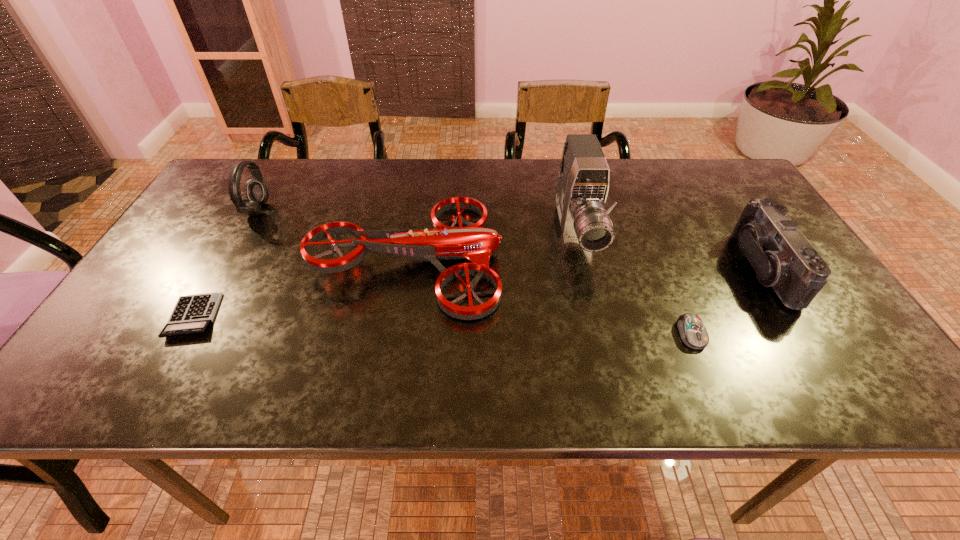
At what (x,y) coordinates should I click in order to perform the action: click on headset that is positioned at the left edge. Please return your answer as a coordinate pair (x, y). The image size is (960, 540). Looking at the image, I should click on click(257, 191).

Locate an element on the screen. calculator that is at the left edge is located at coordinates (193, 314).

Where is `object that is at the right edge`? object that is at the right edge is located at coordinates (782, 257).

Image resolution: width=960 pixels, height=540 pixels. I want to click on object that is positioned at the far left corner, so click(257, 191).

The height and width of the screenshot is (540, 960). In order to click on free location at the far edge of the desktop in this screenshot , I will do `click(399, 204)`.

In the image, there is a desktop. Where is `vacant space at the left edge`? The image size is (960, 540). vacant space at the left edge is located at coordinates (197, 281).

Locate an element on the screen. The image size is (960, 540). vacant space at the right edge of the desktop is located at coordinates (722, 222).

The height and width of the screenshot is (540, 960). What are the coordinates of `free space at the near right corner` in the screenshot? It's located at (839, 383).

Identify the location of vacant area that lies between the shorter camcorder and the drone. (585, 262).

Where is `free area in between the shortest object and the fifth object from left to right`? The height and width of the screenshot is (540, 960). free area in between the shortest object and the fifth object from left to right is located at coordinates (442, 325).